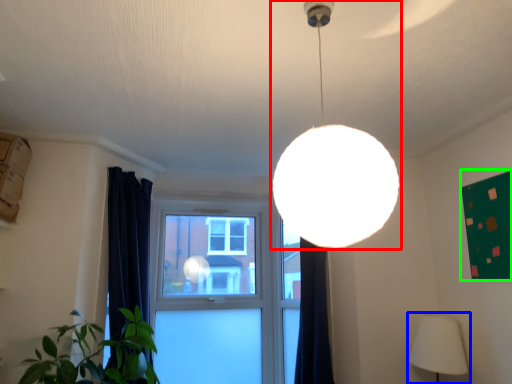
Question: Which object is the closest to the lamp (highlighted by a red box)? Choose among these: lamp (highlighted by a blue box) or bulletin board (highlighted by a green box).

Choices:
 (A) lamp
 (B) bulletin board

Answer: (B)